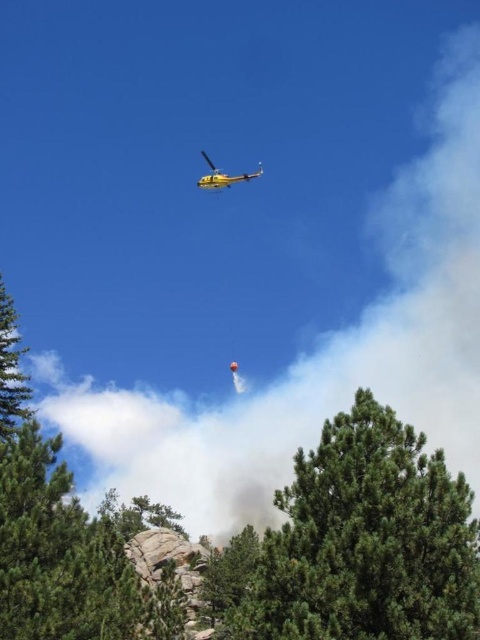
Does green textured tree at center appear under green matte tree at left?

Indeed, green textured tree at center is positioned under green matte tree at left.

Which is in front, point (245, 611) or point (12, 316)?

Positioned in front is point (245, 611).

The height and width of the screenshot is (640, 480). What are the coordinates of `green textured tree at center` in the screenshot? It's located at (359, 541).

Looking at this image, can you confirm if green matte tree at center is bigger than green matte tree at left?

Yes, green matte tree at center is bigger than green matte tree at left.

Where is `green matte tree at center`? green matte tree at center is located at coordinates (67, 557).

Consider the image. Who is more distant from viewer, [267,538] or [158,612]?

Positioned behind is point [158,612].

Locate an element on the screen. green textured tree at center is located at coordinates (359, 541).